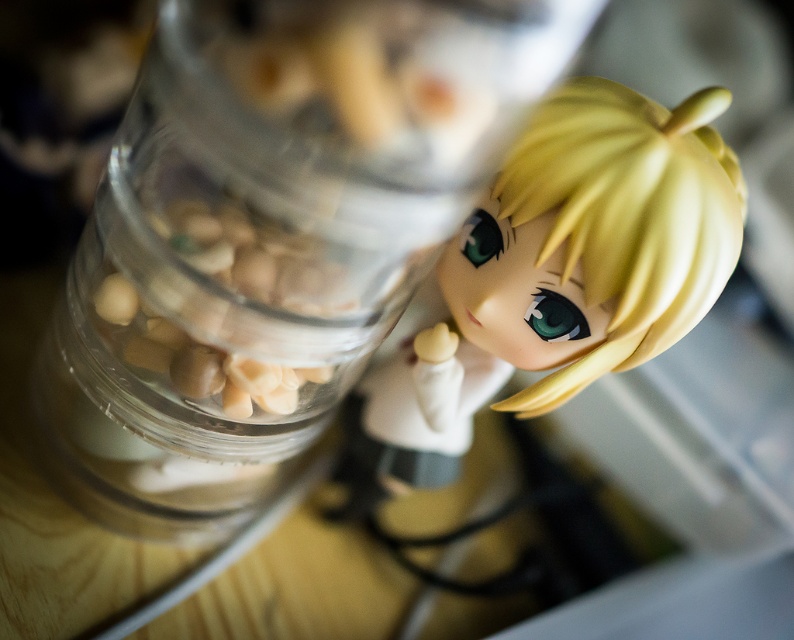
Is transparent glass jar at upper center smaller than satin blonde doll at upper right?

Actually, transparent glass jar at upper center might be larger than satin blonde doll at upper right.

Between transparent glass jar at upper center and satin blonde doll at upper right, which one appears on the right side from the viewer's perspective?

From the viewer's perspective, satin blonde doll at upper right appears more on the right side.

In order to click on transparent glass jar at upper center in this screenshot , I will do `click(270, 236)`.

Identify the location of transparent glass jar at upper center. (270, 236).

Does point (276, 330) come closer to viewer compared to point (101, 305)?

Yes, point (276, 330) is in front of point (101, 305).

Does transparent glass jar at upper center have a greater width compared to translucent glass jar at upper left?

Yes, transparent glass jar at upper center is wider than translucent glass jar at upper left.

Measure the distance between transparent glass jar at upper center and camera.

transparent glass jar at upper center is 6.41 inches away from camera.

Find the location of a particular element. This screenshot has width=794, height=640. transparent glass jar at upper center is located at coordinates pyautogui.click(x=270, y=236).

Who is positioned more to the left, satin blonde doll at upper right or translucent glass jar at upper left?

From the viewer's perspective, translucent glass jar at upper left appears more on the left side.

Can you confirm if satin blonde doll at upper right is thinner than translucent glass jar at upper left?

No, satin blonde doll at upper right is not thinner than translucent glass jar at upper left.

Which is behind, point (727, 262) or point (284, 252)?

The point (727, 262) is behind.

Locate an element on the screen. satin blonde doll at upper right is located at coordinates (x=559, y=275).